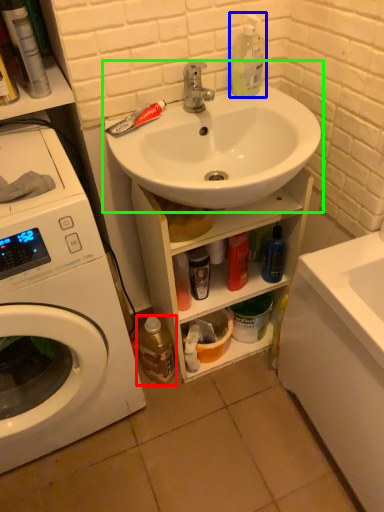
Question: Estimate the real-world distances between objects in this image. Which object is closer to bottle (highlighted by a red box), cleaning product (highlighted by a blue box) or sink (highlighted by a green box)?

Choices:
 (A) cleaning product
 (B) sink

Answer: (B)